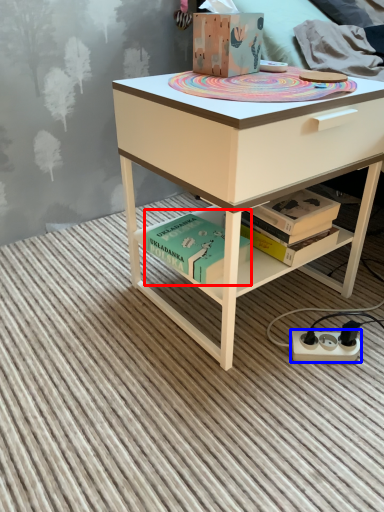
Question: Which object is closer to the camera taking this photo, book (highlighted by a red box) or power plugs and sockets (highlighted by a blue box)?

Choices:
 (A) book
 (B) power plugs and sockets

Answer: (A)